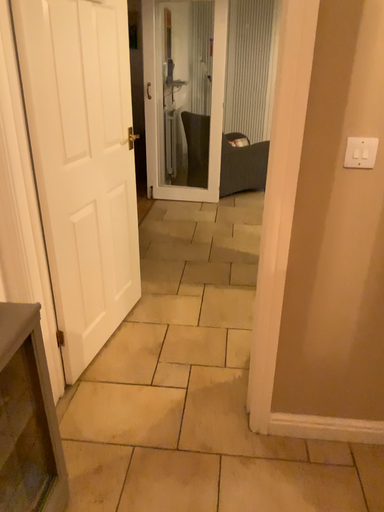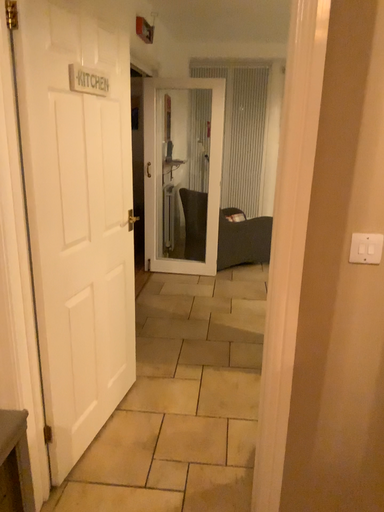
Question: How did the camera likely rotate when shooting the video?

Choices:
 (A) rotated upward
 (B) rotated downward

Answer: (A)